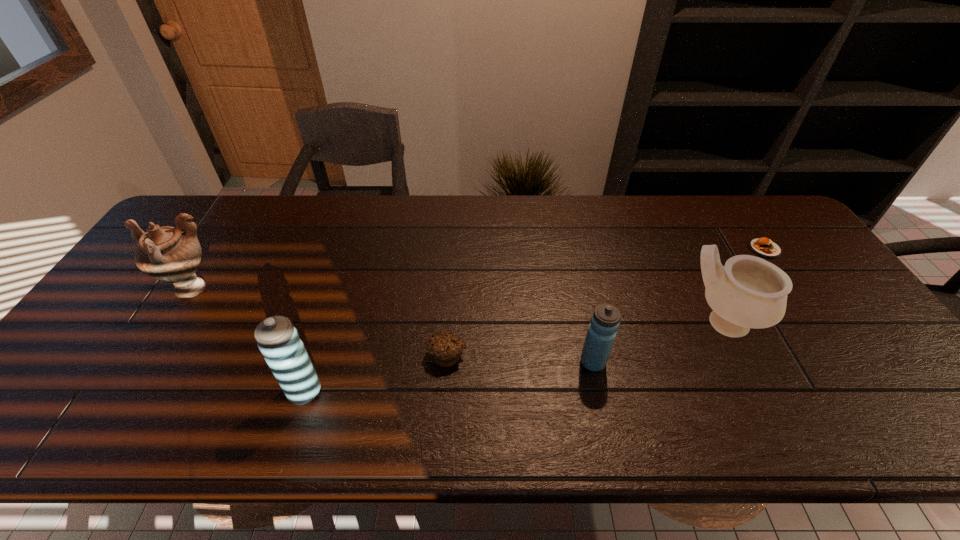
The width and height of the screenshot is (960, 540). Identify the location of free space located 0.360m on the right of the taller water bottle. (480, 392).

I want to click on vacant region located on the right of the farther water bottle, so click(727, 362).

Find the location of a particular element. The height and width of the screenshot is (540, 960). vacant space located on the right of the farthest object is located at coordinates (803, 248).

This screenshot has width=960, height=540. Find the location of `free spot located on the back of the leftmost object`. free spot located on the back of the leftmost object is located at coordinates (228, 229).

The width and height of the screenshot is (960, 540). I want to click on free location located 0.360m on the back of the second shortest object, so click(454, 246).

At what (x,y) coordinates should I click in order to perform the action: click on blank area located on the back of the second object from right to left. Please return your answer as a coordinate pair (x, y). The width and height of the screenshot is (960, 540). Looking at the image, I should click on 668,215.

Image resolution: width=960 pixels, height=540 pixels. Find the location of `object located in the far edge section of the desktop`. object located in the far edge section of the desktop is located at coordinates click(x=764, y=247).

This screenshot has height=540, width=960. In order to click on muffin that is at the near edge in this screenshot , I will do click(x=445, y=347).

You are a GUI agent. You are given a task and a screenshot of the screen. Output one action in this format:
    pyautogui.click(x=<x>, y=<y>)
    Task: Click on the object that is at the left edge
    
    Given the screenshot: What is the action you would take?
    pyautogui.click(x=165, y=253)

Locate an element on the screen. This screenshot has width=960, height=540. object at the right edge is located at coordinates (764, 247).